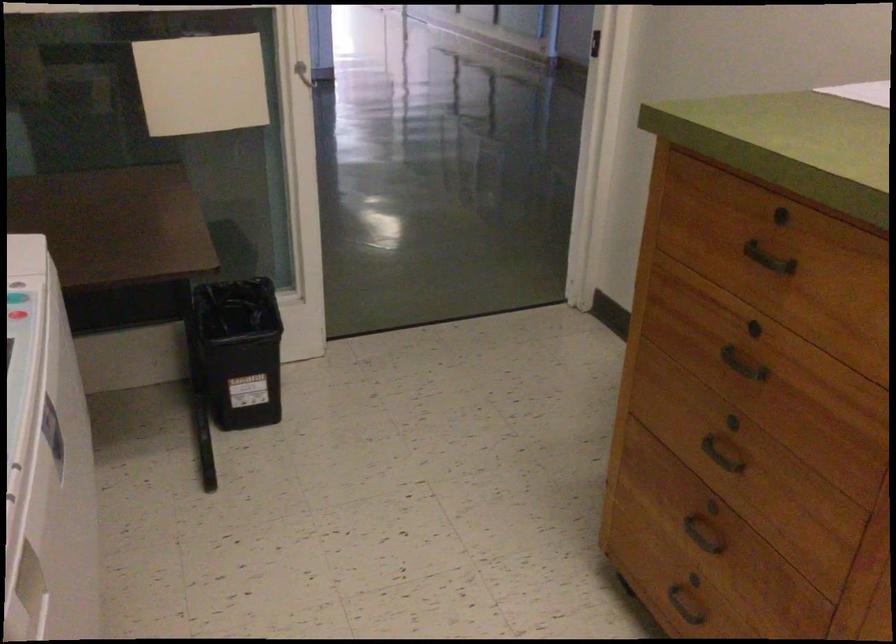
Find where to lift the white paper sheet. Please return your answer as a coordinate pair (x, y).

(201, 84)